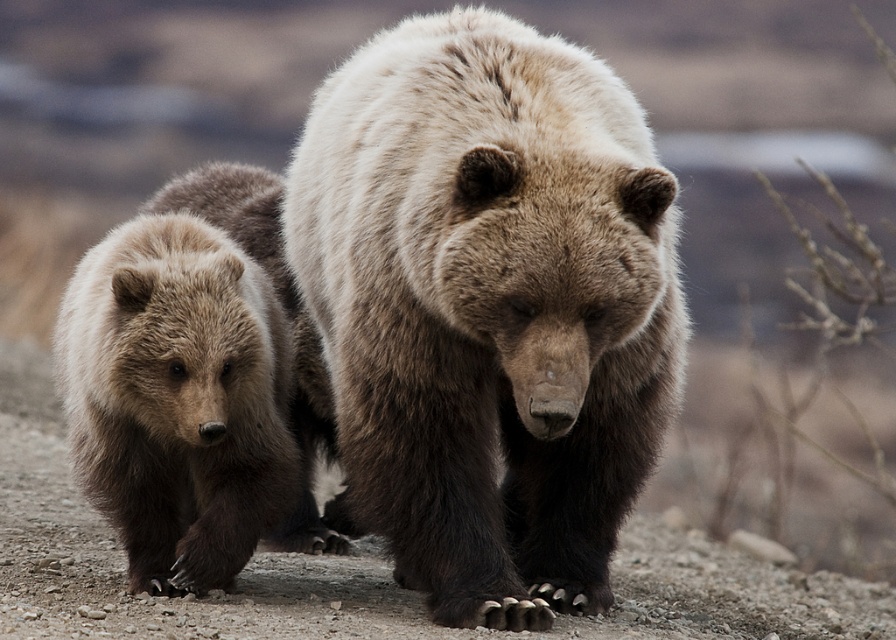
Who is lower down, fuzzy brown bear at center or fuzzy brown bear at left?

fuzzy brown bear at left

Can you confirm if fuzzy brown bear at center is thinner than fuzzy brown bear at left?

No.

Where is `fuzzy brown bear at center`? fuzzy brown bear at center is located at coordinates (489, 307).